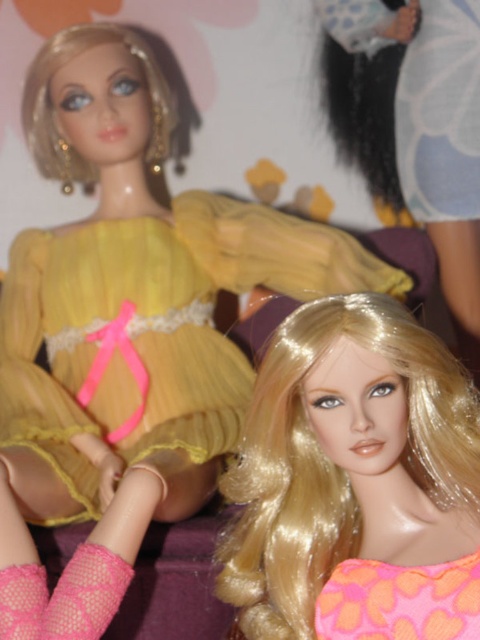
Consider the image. Can you confirm if shiny blonde wig at center is positioned above yellow sheer dress at upper left?

A: Incorrect, shiny blonde wig at center is not positioned above yellow sheer dress at upper left.

Is shiny blonde wig at center bigger than yellow sheer dress at upper left?

No.

This screenshot has width=480, height=640. What are the coordinates of `shiny blonde wig at center` in the screenshot? It's located at (356, 483).

At what (x,y) coordinates should I click in order to perform the action: click on shiny blonde wig at center. Please return your answer as a coordinate pair (x, y). The width and height of the screenshot is (480, 640). Looking at the image, I should click on (356, 483).

Which is above, yellow sheer dress at upper left or pink fabric dress at lower right?

yellow sheer dress at upper left is higher up.

How much distance is there between yellow sheer dress at upper left and pink fabric dress at lower right?

They are 32.20 inches apart.

Which is behind, point (109, 301) or point (464, 564)?

Point (109, 301)

In order to click on yellow sheer dress at upper left in this screenshot , I will do `click(149, 332)`.

Can you confirm if shiny blonde wig at center is positioned to the left of pink fabric dress at lower right?

Indeed, shiny blonde wig at center is positioned on the left side of pink fabric dress at lower right.

Does shiny blonde wig at center appear over pink fabric dress at lower right?

Yes.

From the picture: Who is more distant from viewer, (295, 376) or (385, 593)?

The point (295, 376) is more distant.

Find the location of `shiny blonde wig at center`. shiny blonde wig at center is located at coordinates (356, 483).